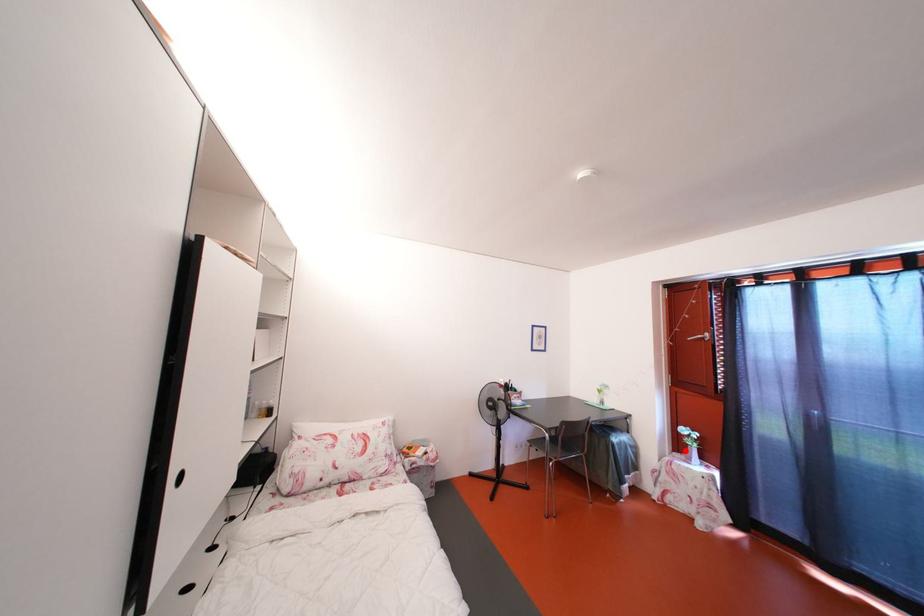
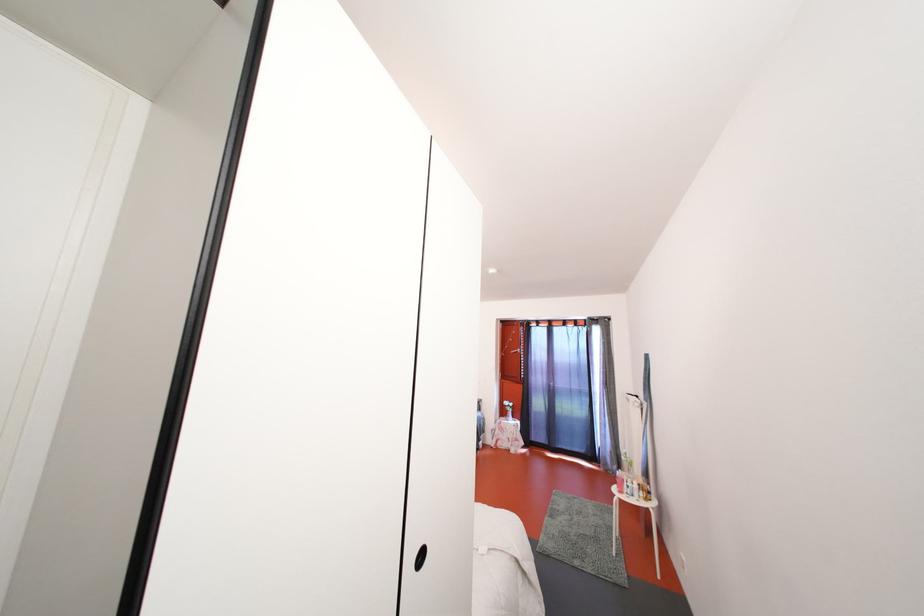
In the second image, find the point that corresponds to the highlighted location in the first image.

(509, 418)